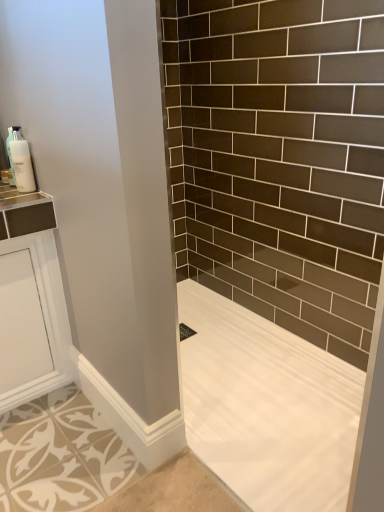
Locate an element on the screen. This screenshot has height=512, width=384. white glossy soap dispenser at upper left is located at coordinates (21, 162).

In the scene shown: In order to face white glossy soap dispenser at upper left, should I rotate leftwards or rightwards?

It's best to rotate left around 21.705 degrees.

The width and height of the screenshot is (384, 512). Describe the element at coordinates (21, 162) in the screenshot. I see `white glossy soap dispenser at upper left` at that location.

Where is `white smooth bathtub at lower right`? The width and height of the screenshot is (384, 512). white smooth bathtub at lower right is located at coordinates (267, 407).

The width and height of the screenshot is (384, 512). Describe the element at coordinates (267, 407) in the screenshot. I see `white smooth bathtub at lower right` at that location.

Find the location of a particular element. The width and height of the screenshot is (384, 512). white glossy soap dispenser at upper left is located at coordinates [21, 162].

Is white glossy soap dispenser at upper left to the left or to the right of white smooth bathtub at lower right in the image?

From the image, it's evident that white glossy soap dispenser at upper left is to the left of white smooth bathtub at lower right.

Relative to white smooth bathtub at lower right, is white glossy soap dispenser at upper left in front or behind?

white glossy soap dispenser at upper left is behind white smooth bathtub at lower right.

Does point (21, 135) come farther from viewer compared to point (282, 338)?

No, (21, 135) is closer to viewer.

From the image's perspective, between white glossy soap dispenser at upper left and white smooth bathtub at lower right, which one is located above?

white glossy soap dispenser at upper left appears higher in the image.

From a real-world perspective, between white glossy soap dispenser at upper left and white smooth bathtub at lower right, who is vertically higher?

white glossy soap dispenser at upper left is physically above.

Does white glossy soap dispenser at upper left have a greater width compared to white smooth bathtub at lower right?

No, white glossy soap dispenser at upper left is not wider than white smooth bathtub at lower right.

Can you confirm if white glossy soap dispenser at upper left is taller than white smooth bathtub at lower right?

Indeed, white glossy soap dispenser at upper left has a greater height compared to white smooth bathtub at lower right.

Is white glossy soap dispenser at upper left smaller than white smooth bathtub at lower right?

Indeed, white glossy soap dispenser at upper left has a smaller size compared to white smooth bathtub at lower right.

Do you think white glossy soap dispenser at upper left is within white smooth bathtub at lower right, or outside of it?

white glossy soap dispenser at upper left lies outside white smooth bathtub at lower right.

Can you see white glossy soap dispenser at upper left touching white smooth bathtub at lower right?

They are not placed beside each other.

Is white glossy soap dispenser at upper left aimed at white smooth bathtub at lower right?

No, white glossy soap dispenser at upper left is not turned towards white smooth bathtub at lower right.

How different are the orientations of white glossy soap dispenser at upper left and white smooth bathtub at lower right in degrees?

There is a 0.803-degree angle between the facing directions of white glossy soap dispenser at upper left and white smooth bathtub at lower right.

Measure the distance from white glossy soap dispenser at upper left to white smooth bathtub at lower right.

white glossy soap dispenser at upper left and white smooth bathtub at lower right are 1.17 meters apart.

The image size is (384, 512). Find the location of `soap dispenser above the white smooth bathtub at lower right (from a real-world perspective)`. soap dispenser above the white smooth bathtub at lower right (from a real-world perspective) is located at coordinates (21, 162).

Considering the relative positions of white smooth bathtub at lower right and white glossy soap dispenser at upper left in the image provided, is white smooth bathtub at lower right to the left or to the right of white glossy soap dispenser at upper left?

Based on their positions, white smooth bathtub at lower right is located to the right of white glossy soap dispenser at upper left.

Considering their positions, is white smooth bathtub at lower right located in front of or behind white glossy soap dispenser at upper left?

Visually, white smooth bathtub at lower right is located in front of white glossy soap dispenser at upper left.

Between point (221, 360) and point (31, 173), which one is positioned in front?

Positioned in front is point (31, 173).

From the image's perspective, between white smooth bathtub at lower right and white glossy soap dispenser at upper left, which one is located above?

white glossy soap dispenser at upper left is shown above in the image.

Looking at this image, from a real-world perspective, who is located lower, white smooth bathtub at lower right or white glossy soap dispenser at upper left?

white smooth bathtub at lower right is physically lower.

Is white smooth bathtub at lower right thinner than white glossy soap dispenser at upper left?

In fact, white smooth bathtub at lower right might be wider than white glossy soap dispenser at upper left.

Is white smooth bathtub at lower right shorter than white glossy soap dispenser at upper left?

Yes.

Who is bigger, white smooth bathtub at lower right or white glossy soap dispenser at upper left?

white smooth bathtub at lower right is bigger.

Would you say white smooth bathtub at lower right is outside white glossy soap dispenser at upper left?

Absolutely, white smooth bathtub at lower right is external to white glossy soap dispenser at upper left.

Is white smooth bathtub at lower right positioned far away from white glossy soap dispenser at upper left?

white smooth bathtub at lower right is positioned a significant distance from white glossy soap dispenser at upper left.

Is white smooth bathtub at lower right oriented towards white glossy soap dispenser at upper left?

No, white smooth bathtub at lower right is not aimed at white glossy soap dispenser at upper left.

What's the angular difference between white smooth bathtub at lower right and white glossy soap dispenser at upper left's facing directions?

There is a 0.803-degree angle between the facing directions of white smooth bathtub at lower right and white glossy soap dispenser at upper left.

You are a GUI agent. You are given a task and a screenshot of the screen. Output one action in this format:
    pyautogui.click(x=<x>, y=<y>)
    Task: Click on the soap dispenser behind the white smooth bathtub at lower right
    This screenshot has height=512, width=384.
    Given the screenshot: What is the action you would take?
    pyautogui.click(x=21, y=162)

At what (x,y) coordinates should I click in order to perform the action: click on bath below the white glossy soap dispenser at upper left (from a real-world perspective). Please return your answer as a coordinate pair (x, y). Image resolution: width=384 pixels, height=512 pixels. Looking at the image, I should click on (267, 407).

At what (x,y) coordinates should I click in order to perform the action: click on soap dispenser above the white smooth bathtub at lower right (from a real-world perspective). Please return your answer as a coordinate pair (x, y). Looking at the image, I should click on (21, 162).